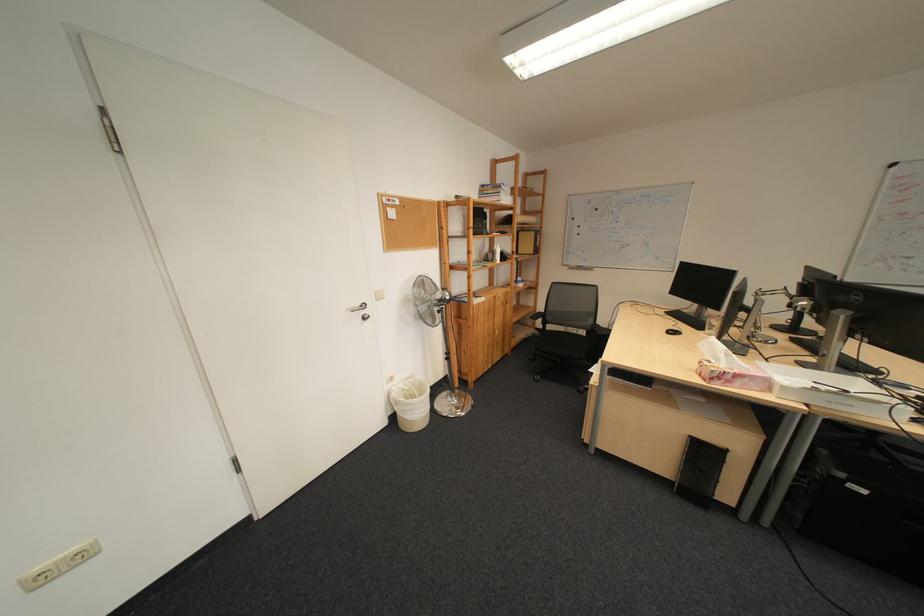
Where would you resting arm the chair armrest? Please return your answer as a coordinate pair (x, y).

(531, 318)